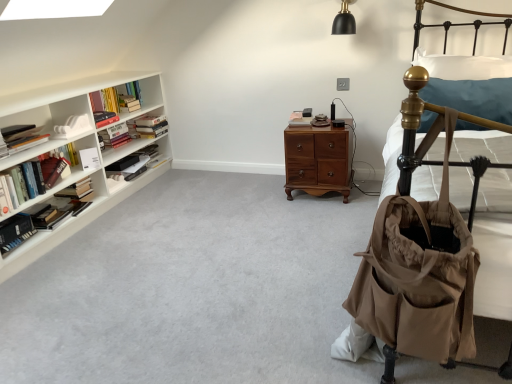
In order to click on free location in front of white matte book at center, which is the first book from right to left in this screenshot , I will do `click(308, 122)`.